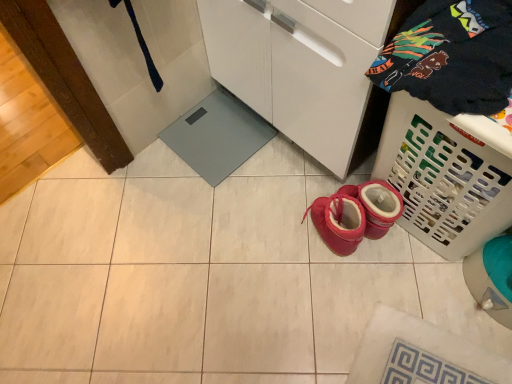
Question: Does dark blue cotton t-shirt at upper right have a greater width compared to white plastic laundry basket at lower right?

Choices:
 (A) no
 (B) yes

Answer: (B)

Question: Does dark blue cotton t-shirt at upper right appear on the left side of white plastic laundry basket at lower right?

Choices:
 (A) yes
 (B) no

Answer: (A)

Question: Would you consider dark blue cotton t-shirt at upper right to be distant from white plastic laundry basket at lower right?

Choices:
 (A) yes
 (B) no

Answer: (B)

Question: Is dark blue cotton t-shirt at upper right taller than white plastic laundry basket at lower right?

Choices:
 (A) no
 (B) yes

Answer: (A)

Question: Does dark blue cotton t-shirt at upper right have a smaller size compared to white plastic laundry basket at lower right?

Choices:
 (A) yes
 (B) no

Answer: (A)

Question: From a real-world perspective, is dark blue cotton t-shirt at upper right positioned over white plastic laundry basket at lower right based on gravity?

Choices:
 (A) no
 (B) yes

Answer: (B)

Question: Is white plastic laundry basket at lower right aimed at dark blue cotton t-shirt at upper right?

Choices:
 (A) no
 (B) yes

Answer: (A)

Question: From the image's perspective, is white plastic laundry basket at lower right located above dark blue cotton t-shirt at upper right?

Choices:
 (A) yes
 (B) no

Answer: (B)

Question: Is white plastic laundry basket at lower right bigger than dark blue cotton t-shirt at upper right?

Choices:
 (A) no
 (B) yes

Answer: (B)

Question: From a real-world perspective, is white plastic laundry basket at lower right physically above dark blue cotton t-shirt at upper right?

Choices:
 (A) no
 (B) yes

Answer: (A)

Question: From the image's perspective, does white plastic laundry basket at lower right appear lower than dark blue cotton t-shirt at upper right?

Choices:
 (A) no
 (B) yes

Answer: (B)

Question: Can you confirm if white plastic laundry basket at lower right is taller than dark blue cotton t-shirt at upper right?

Choices:
 (A) yes
 (B) no

Answer: (A)

Question: From a real-world perspective, is white plastic laundry basket at lower right above or below dark blue cotton t-shirt at upper right?

Choices:
 (A) above
 (B) below

Answer: (B)